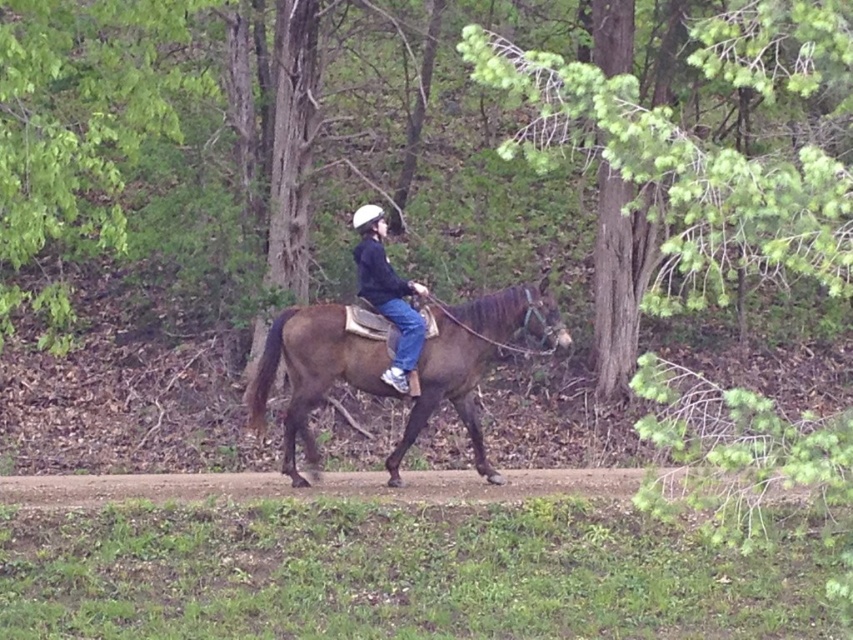
You are planning to take a photo of the brown dirt track at center and the black matte jacket at center. Which object should you zoom in on to capture more details of the smaller one?

The brown dirt track at center is smaller than the black matte jacket at center, so you should zoom in on the brown dirt track at center to capture more details of the smaller one.

You are a hiker trying to follow the path. From your perspective, is the brown dirt track at center above or below the black matte jacket at center?

The brown dirt track at center is located below the black matte jacket at center, so it is below.